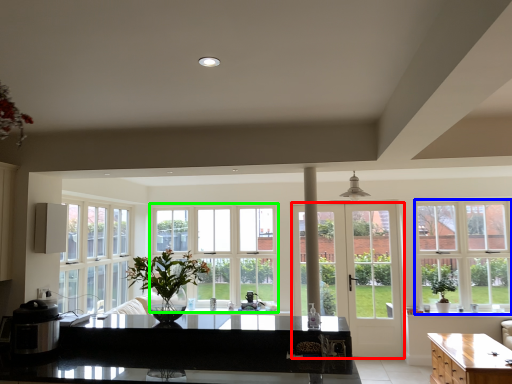
Question: Which object is positioned farthest from door (highlighted by a red box)? Select from window (highlighted by a blue box) and window (highlighted by a green box).

Choices:
 (A) window
 (B) window

Answer: (B)